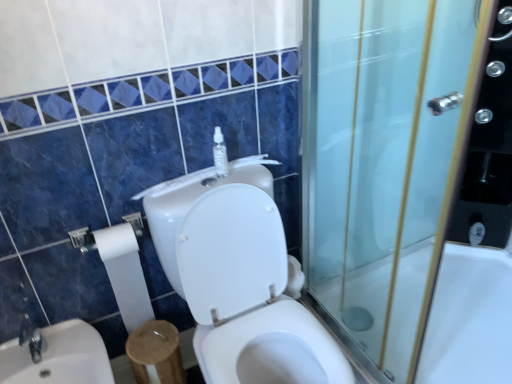
I want to click on free spot in front of clear plastic bottle at upper center, so click(x=211, y=194).